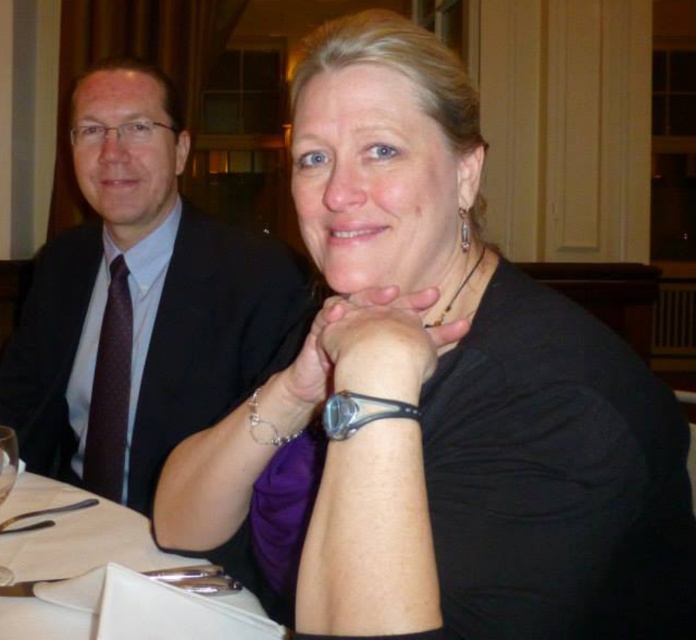
Question: Can you confirm if white paper napkin at lower center is wider than brown dotted tie at left?

Choices:
 (A) yes
 (B) no

Answer: (A)

Question: Estimate the real-world distances between objects in this image. Which object is closer to the white paper napkin at lower center?

Choices:
 (A) transparent glass at lower left
 (B) black leather watch at center
 (C) matte black suit at left

Answer: (A)

Question: Among these objects, which one is nearest to the camera?

Choices:
 (A) transparent glass at lower left
 (B) matte black suit at left
 (C) black leather watch at center
 (D) silver metallic bracelet at lower center

Answer: (C)

Question: Which of the following is the closest to the observer?

Choices:
 (A) transparent glass at lower left
 (B) brown dotted tie at left
 (C) silver metallic bracelet at lower center
 (D) white paper napkin at lower center

Answer: (D)

Question: Considering the relative positions of black leather watch at center and brown dotted tie at left in the image provided, where is black leather watch at center located with respect to brown dotted tie at left?

Choices:
 (A) left
 (B) right

Answer: (B)

Question: Does brown dotted tie at left appear on the right side of transparent glass at lower left?

Choices:
 (A) no
 (B) yes

Answer: (A)